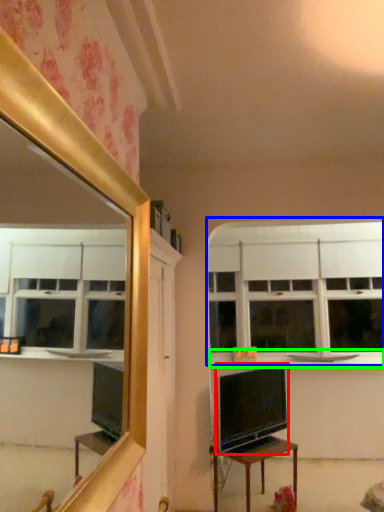
Question: Estimate the real-world distances between objects in this image. Which object is farther from television (highlighted by a red box), window (highlighted by a blue box) or counter top (highlighted by a green box)?

Choices:
 (A) window
 (B) counter top

Answer: (A)